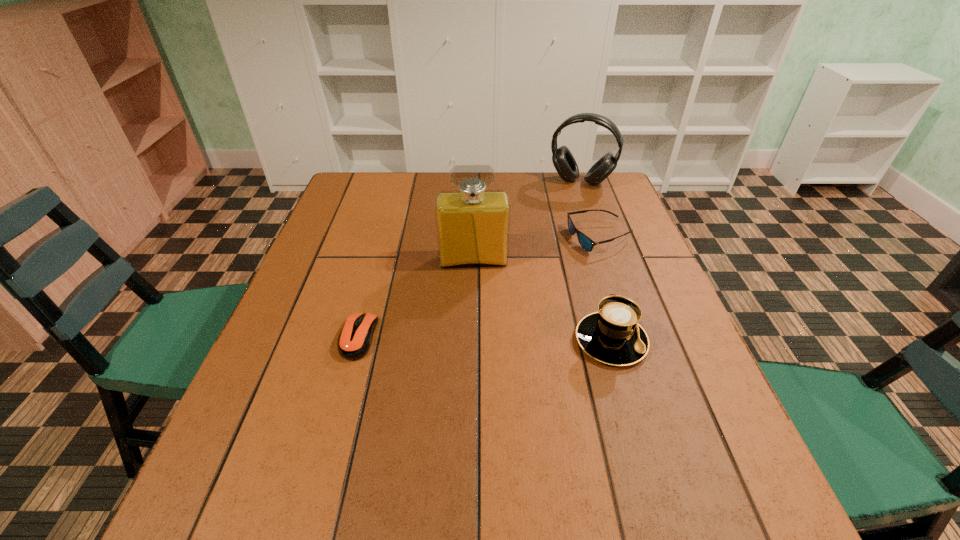
Find the location of a particular element. The image size is (960, 540). blank space located 0.120m on the front-facing side of the second object from left to right is located at coordinates (476, 303).

Locate an element on the screen. The height and width of the screenshot is (540, 960). free location located 0.050m on the front-facing side of the second object from left to right is located at coordinates pyautogui.click(x=475, y=284).

The image size is (960, 540). What are the coordinates of `vacant space situated at the front of the second shortest object showing the lenses` in the screenshot? It's located at (511, 339).

The image size is (960, 540). Find the location of `free space located at the front of the second shortest object showing the lenses`. free space located at the front of the second shortest object showing the lenses is located at coordinates (543, 302).

Where is `free region located at the front of the second shortest object showing the lenses`? This screenshot has height=540, width=960. free region located at the front of the second shortest object showing the lenses is located at coordinates (503, 347).

You are a GUI agent. You are given a task and a screenshot of the screen. Output one action in this format:
    pyautogui.click(x=<x>, y=<y>)
    Task: Click on the free space located on the earcups of the farthest object
    The width and height of the screenshot is (960, 540).
    Given the screenshot: What is the action you would take?
    pyautogui.click(x=560, y=226)

This screenshot has height=540, width=960. Find the location of `vacant area situated on the earcups of the farthest object`. vacant area situated on the earcups of the farthest object is located at coordinates (552, 246).

Locate an element on the screen. The height and width of the screenshot is (540, 960). vacant space located 0.070m on the earcups of the farthest object is located at coordinates (568, 202).

Find the location of `object that is positioned at the far edge`. object that is positioned at the far edge is located at coordinates (563, 160).

Where is `object that is positioned at the left edge`? object that is positioned at the left edge is located at coordinates (355, 339).